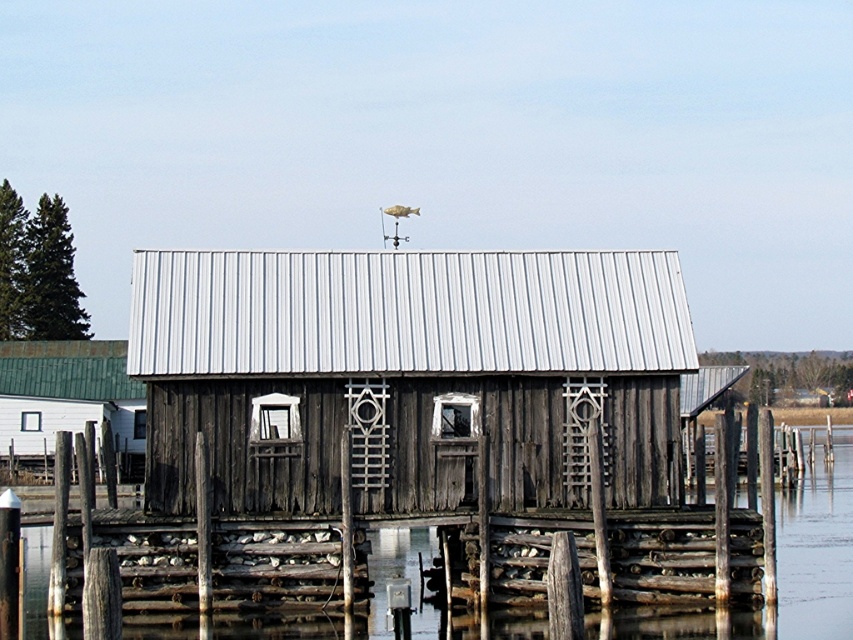
Question: Which point is farther to the camera?

Choices:
 (A) (236, 424)
 (B) (784, 500)
 (C) (140, 444)

Answer: (C)

Question: Can you confirm if transparent wooden water at lower center is thinner than green wooden hut at left?

Choices:
 (A) yes
 (B) no

Answer: (B)

Question: Is wooden cabin at center positioned in front of green wooden hut at left?

Choices:
 (A) yes
 (B) no

Answer: (A)

Question: Does transparent wooden water at lower center lie in front of green wooden hut at left?

Choices:
 (A) yes
 (B) no

Answer: (A)

Question: Which of these objects is positioned farthest from the green wooden hut at left?

Choices:
 (A) transparent wooden water at lower center
 (B) wooden cabin at center

Answer: (A)

Question: Which of the following is the closest to the observer?

Choices:
 (A) green wooden hut at left
 (B) transparent wooden water at lower center
 (C) wooden cabin at center

Answer: (B)